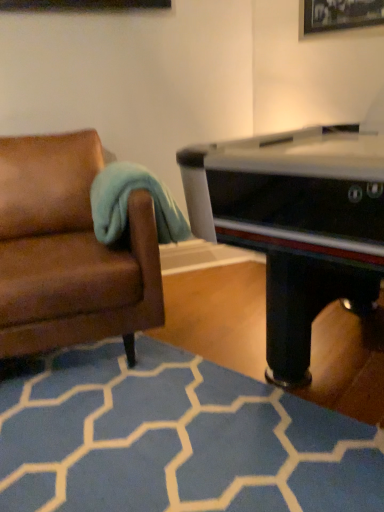
Find the location of `free space underneath blue carpet at lower center (from a real-world perspective)`. free space underneath blue carpet at lower center (from a real-world perspective) is located at coordinates (147, 448).